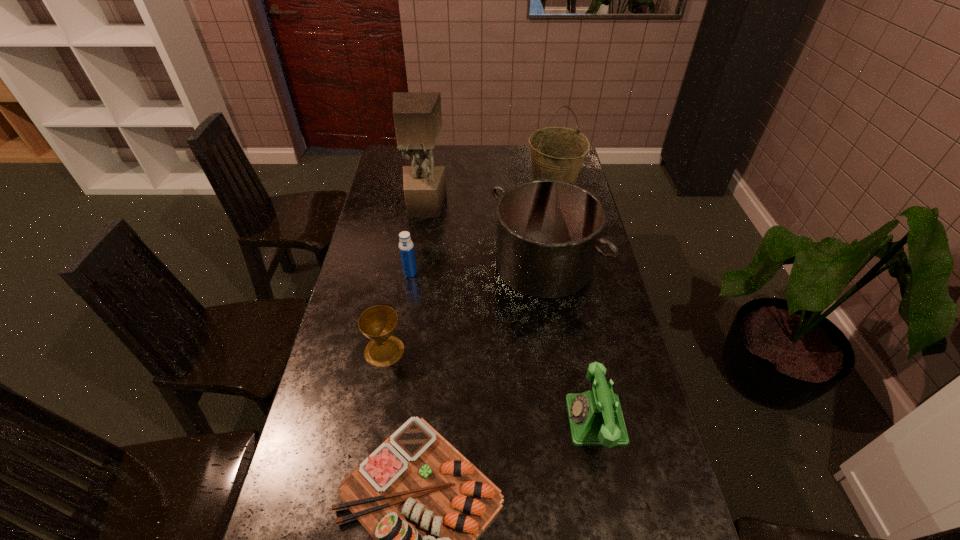
You are a GUI agent. You are given a task and a screenshot of the screen. Output one action in this format:
    pyautogui.click(x=<x>, y=<y>)
    Task: Click on the vacant area that satisfies the following two spatial constraints: 1. on the front-facing side of the sculpture; 2. on the left side of the pan
    
    Given the screenshot: What is the action you would take?
    pyautogui.click(x=416, y=265)